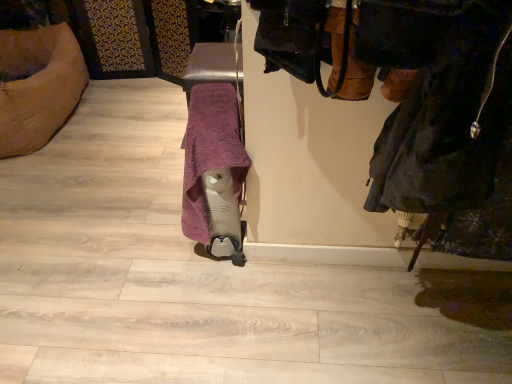
Measure the distance between point (234, 171) and camera.

Point (234, 171) is 4.42 feet from camera.

Locate an element on the screen. The height and width of the screenshot is (384, 512). purple soft towel at center is located at coordinates (210, 152).

What do you see at coordinates (210, 152) in the screenshot?
I see `purple soft towel at center` at bounding box center [210, 152].

Where is `dark gray fabric coat at right`? This screenshot has width=512, height=384. dark gray fabric coat at right is located at coordinates (447, 128).

Describe the element at coordinates (447, 128) in the screenshot. I see `dark gray fabric coat at right` at that location.

The image size is (512, 384). I want to click on purple soft towel at center, so click(x=210, y=152).

Which is more to the left, purple soft towel at center or dark gray fabric coat at right?

purple soft towel at center is more to the left.

Is purple soft towel at center further to the viewer compared to dark gray fabric coat at right?

Yes, purple soft towel at center is further from the viewer.

Considering the positions of point (225, 113) and point (433, 200), is point (225, 113) closer or farther from the camera than point (433, 200)?

Point (225, 113) appears to be farther away from the viewer than point (433, 200).

In the scene shown: From the image's perspective, between purple soft towel at center and dark gray fabric coat at right, who is located below?

purple soft towel at center, from the image's perspective.

From a real-world perspective, does purple soft towel at center stand above dark gray fabric coat at right?

No, from a real-world perspective, purple soft towel at center is not above dark gray fabric coat at right.

Considering the sizes of objects purple soft towel at center and dark gray fabric coat at right in the image provided, who is wider, purple soft towel at center or dark gray fabric coat at right?

With larger width is dark gray fabric coat at right.

Is purple soft towel at center shorter than dark gray fabric coat at right?

In fact, purple soft towel at center may be taller than dark gray fabric coat at right.

Considering the relative sizes of purple soft towel at center and dark gray fabric coat at right in the image provided, is purple soft towel at center bigger than dark gray fabric coat at right?

Yes, purple soft towel at center is bigger than dark gray fabric coat at right.

Is purple soft towel at center inside the boundaries of dark gray fabric coat at right, or outside?

purple soft towel at center exists outside the volume of dark gray fabric coat at right.

Is purple soft towel at center placed right next to dark gray fabric coat at right?

purple soft towel at center and dark gray fabric coat at right are clearly separated.

Is purple soft towel at center facing towards dark gray fabric coat at right?

No, purple soft towel at center does not turn towards dark gray fabric coat at right.

The width and height of the screenshot is (512, 384). I want to click on laundry in front of the purple soft towel at center, so click(447, 128).

Considering the positions of objects dark gray fabric coat at right and purple soft towel at center in the image provided, who is more to the right, dark gray fabric coat at right or purple soft towel at center?

dark gray fabric coat at right.

Consider the image. Who is more distant, dark gray fabric coat at right or purple soft towel at center?

Positioned behind is purple soft towel at center.

Is point (504, 115) farther from camera compared to point (198, 108)?

No, (504, 115) is closer to viewer.

From the image's perspective, would you say dark gray fabric coat at right is shown under purple soft towel at center?

No.

From a real-world perspective, is dark gray fabric coat at right located beneath purple soft towel at center?

Incorrect, from a real-world perspective, dark gray fabric coat at right is higher than purple soft towel at center.

Consider the image. Which object is wider, dark gray fabric coat at right or purple soft towel at center?

dark gray fabric coat at right.

Does dark gray fabric coat at right have a lesser height compared to purple soft towel at center?

Yes.

Can you confirm if dark gray fabric coat at right is bigger than purple soft towel at center?

Actually, dark gray fabric coat at right might be smaller than purple soft towel at center.

Would you say dark gray fabric coat at right is outside purple soft towel at center?

Yes, dark gray fabric coat at right is not within purple soft towel at center.

Is dark gray fabric coat at right far away from purple soft towel at center?

No.

In the scene shown: Could you tell me if dark gray fabric coat at right is turned towards purple soft towel at center?

No, dark gray fabric coat at right is not facing towards purple soft towel at center.

Identify the location of laundry above the purple soft towel at center (from a real-world perspective). pos(447,128).

This screenshot has width=512, height=384. In order to click on laundry above the purple soft towel at center (from the image's perspective) in this screenshot , I will do pyautogui.click(x=447, y=128).

The height and width of the screenshot is (384, 512). Find the location of `bath towel lying behind the dark gray fabric coat at right`. bath towel lying behind the dark gray fabric coat at right is located at coordinates (210, 152).